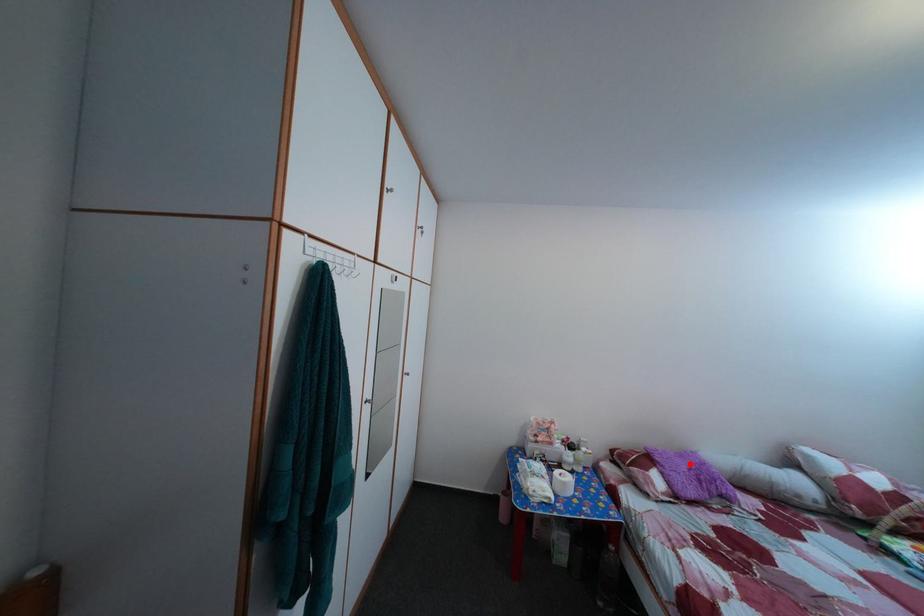
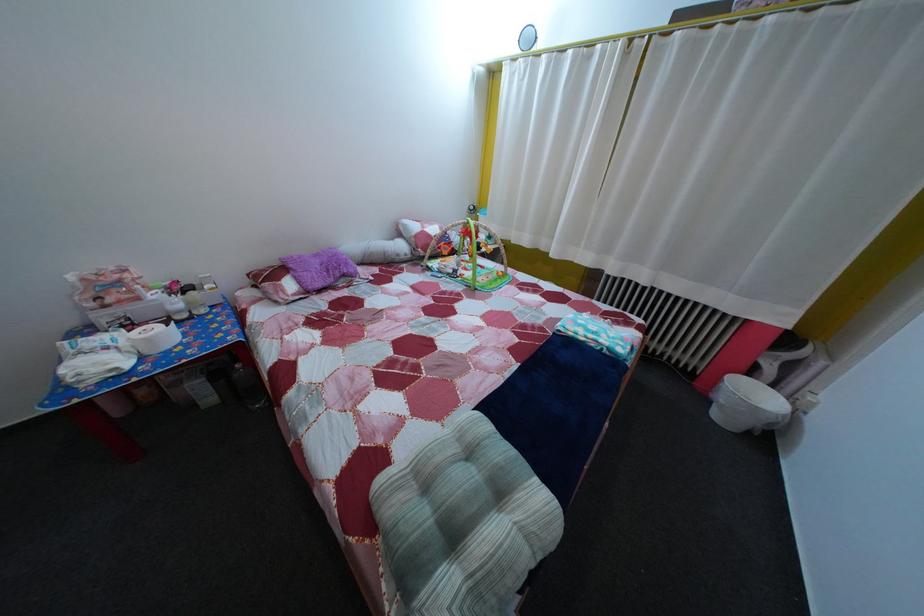
Find the pixel in the second image that matches the highlighted location in the first image.

(325, 262)